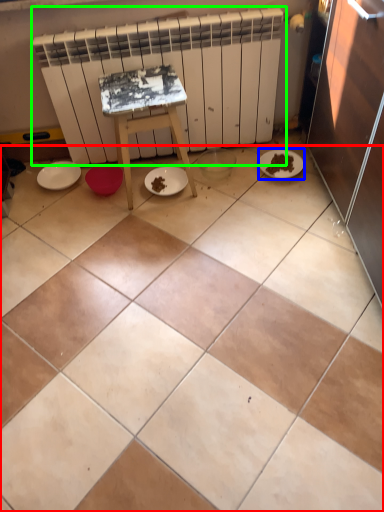
Question: Based on their relative distances, which object is nearer to ceramic tile (highlighted by a red box)? Choose from paper plate (highlighted by a blue box) and radiator (highlighted by a green box).

Choices:
 (A) paper plate
 (B) radiator

Answer: (B)